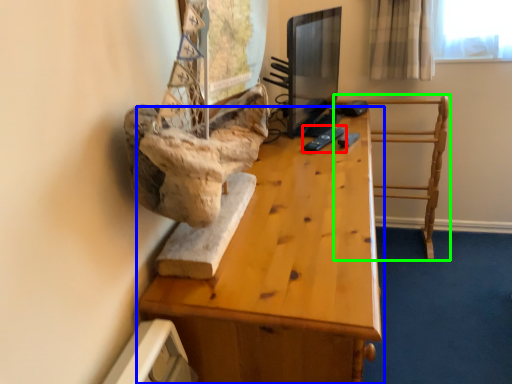
Question: Estimate the real-world distances between objects in this image. Which object is closer to remote (highlighted by a red box), table (highlighted by a blue box) or furniture (highlighted by a green box)?

Choices:
 (A) table
 (B) furniture

Answer: (A)